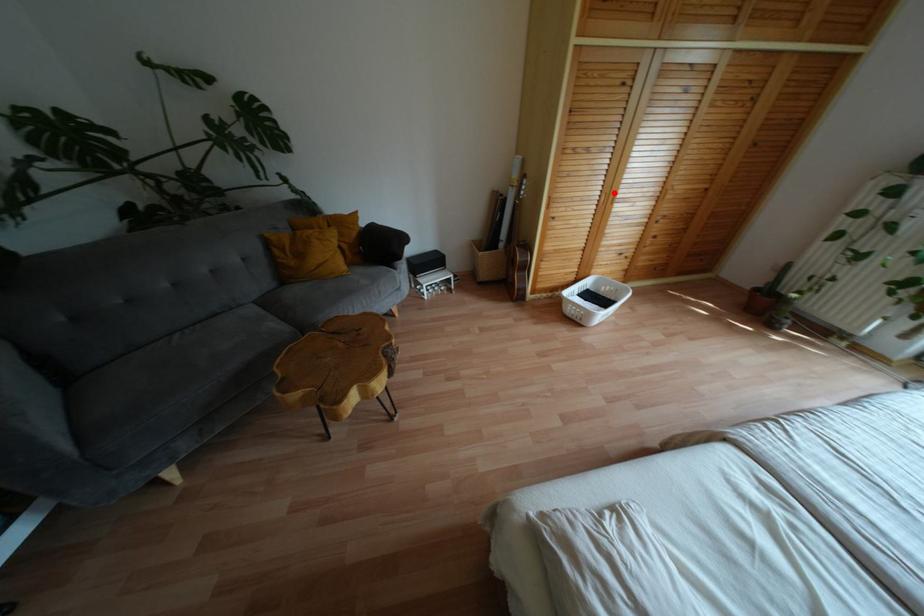
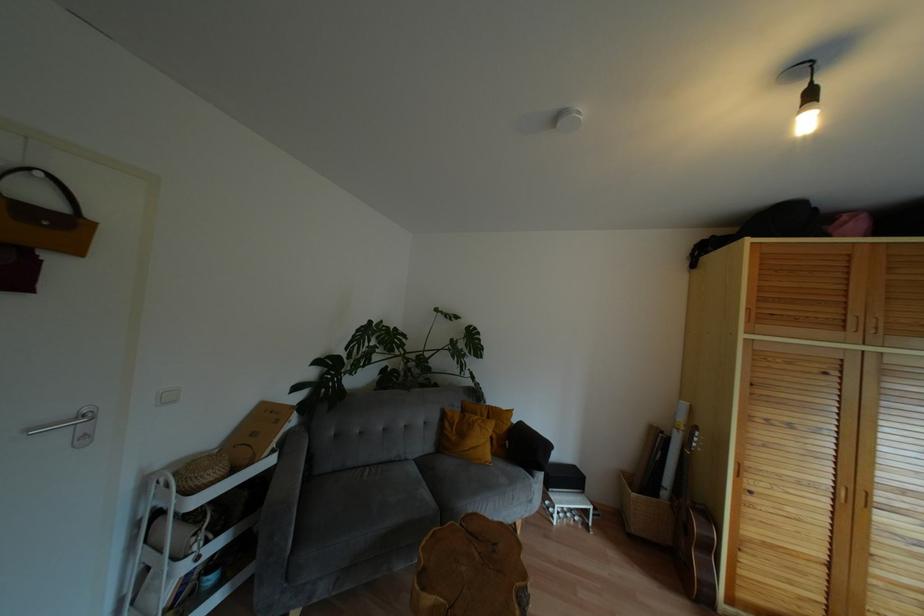
Question: I am providing you with two images of the same scene from different viewpoints. A red point is shown in image1. For the corresponding object point in image2, is it positioned nearer or farther from the camera?

Choices:
 (A) Nearer
 (B) Farther

Answer: (A)